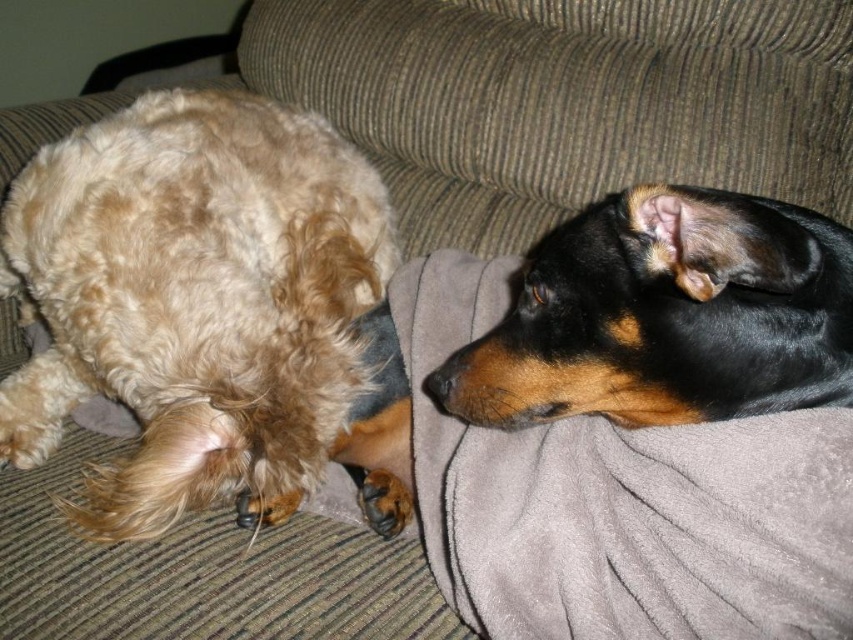
Consider the image. Which is below, fluffy golden fur at left or gray soft blanket at upper center?

fluffy golden fur at left

The width and height of the screenshot is (853, 640). Find the location of `fluffy golden fur at left`. fluffy golden fur at left is located at coordinates (193, 298).

Locate an element on the screen. This screenshot has width=853, height=640. fluffy golden fur at left is located at coordinates (193, 298).

Looking at this image, does gray soft blanket at upper center have a greater height compared to black shiny dog at upper right?

Correct, gray soft blanket at upper center is much taller as black shiny dog at upper right.

Between gray soft blanket at upper center and black shiny dog at upper right, which one has less height?

Standing shorter between the two is black shiny dog at upper right.

Where is `gray soft blanket at upper center`? gray soft blanket at upper center is located at coordinates (566, 100).

Between fluffy golden fur at left and black shiny dog at upper right, which one has less height?

black shiny dog at upper right is shorter.

Does fluffy golden fur at left have a smaller size compared to black shiny dog at upper right?

No.

The height and width of the screenshot is (640, 853). I want to click on fluffy golden fur at left, so click(x=193, y=298).

I want to click on fluffy golden fur at left, so click(x=193, y=298).